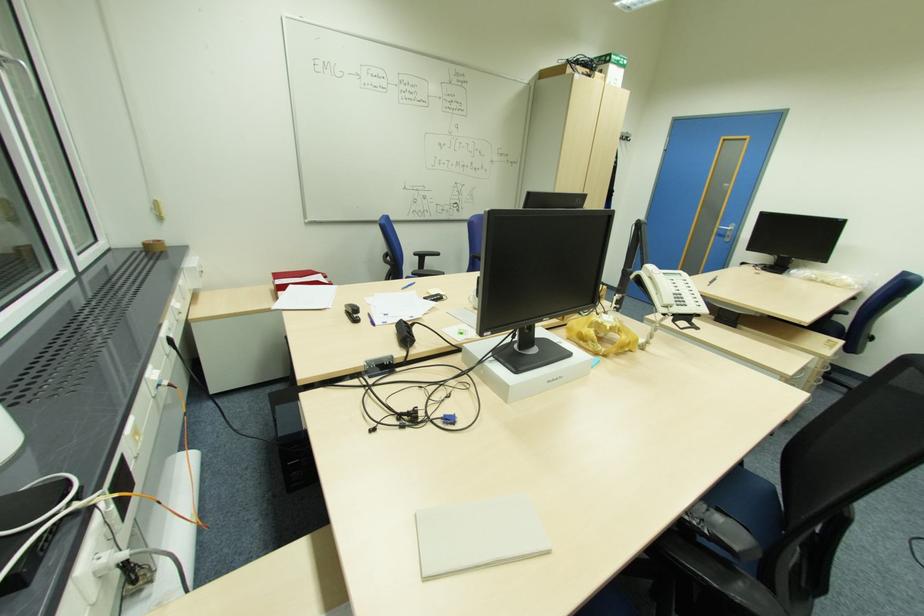
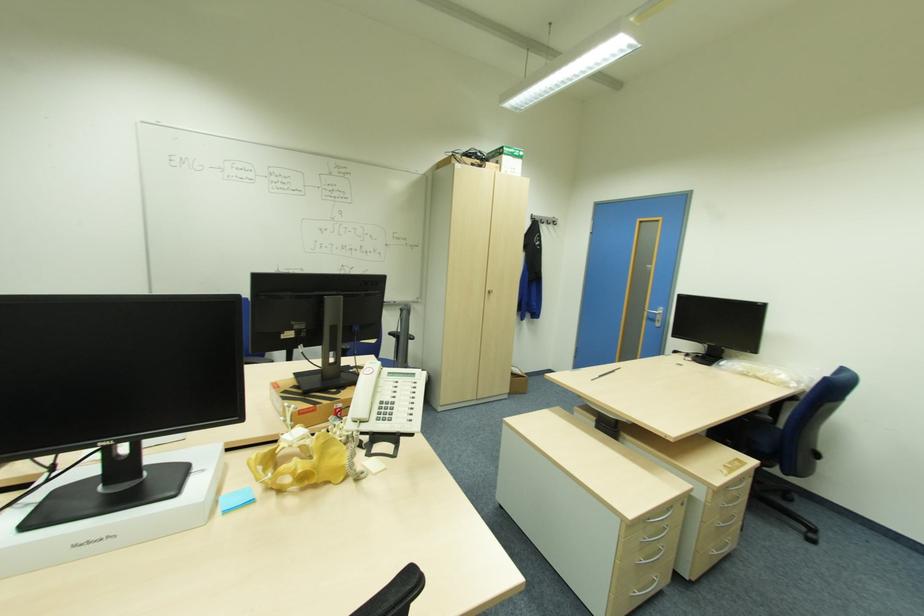
The point at (732, 236) is marked in the first image. Where is the corresponding point in the second image?

(661, 321)